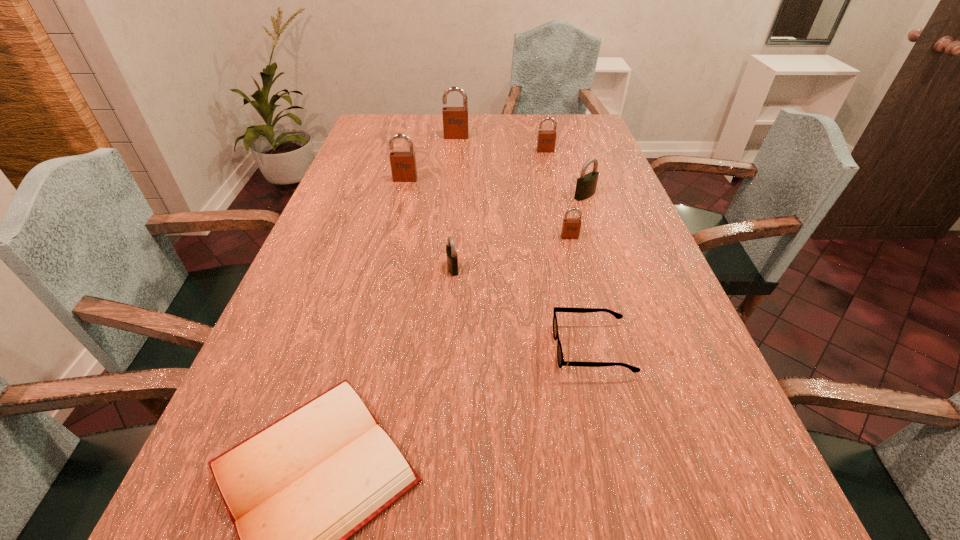
This screenshot has height=540, width=960. Find the location of `vacant space located on the arms of the seventh farthest object`. vacant space located on the arms of the seventh farthest object is located at coordinates (480, 349).

This screenshot has height=540, width=960. I want to click on vacant space situated 0.200m on the arms of the seventh farthest object, so click(x=455, y=349).

Identify the location of vacant area located 0.090m on the arms of the seventh farthest object. The image size is (960, 540). (511, 349).

Identify the location of object located in the far edge section of the desktop. The width and height of the screenshot is (960, 540). (455, 119).

Find the location of a particular element. padlock present at the right edge is located at coordinates (586, 184).

The height and width of the screenshot is (540, 960). In order to click on spectacles situated at the right edge in this screenshot , I will do pyautogui.click(x=560, y=358).

Locate an element on the screen. This screenshot has width=960, height=540. vacant region at the far edge of the desktop is located at coordinates (506, 135).

The image size is (960, 540). I want to click on blank space at the left edge of the desktop, so click(359, 247).

At what (x,y) coordinates should I click in order to perform the action: click on vacant space at the right edge of the desktop. Please return your answer as a coordinate pair (x, y). This screenshot has height=540, width=960. Looking at the image, I should click on (663, 274).

What are the coordinates of `empty space between the second farthest brown padlock and the farthest padlock` in the screenshot? It's located at (501, 144).